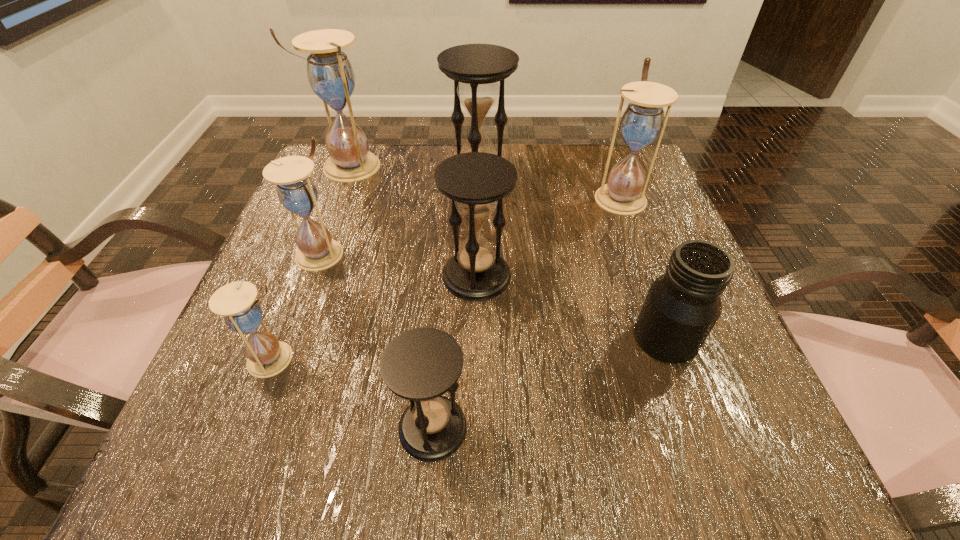
Identify the location of object present at the near edge. (421, 364).

The image size is (960, 540). What are the coordinates of `hourglass that is at the right edge` in the screenshot? It's located at click(643, 120).

The width and height of the screenshot is (960, 540). I want to click on jar that is positioned at the right edge, so 682,306.

At what (x,y) coordinates should I click in order to perform the action: click on object at the far left corner. Please return your answer as a coordinate pair (x, y). This screenshot has width=960, height=540. Looking at the image, I should click on (330, 74).

This screenshot has height=540, width=960. Find the location of `object present at the far right corner`. object present at the far right corner is located at coordinates (643, 120).

Where is `free space at the far edge`? This screenshot has height=540, width=960. free space at the far edge is located at coordinates (444, 160).

Locate an element on the screen. The width and height of the screenshot is (960, 540). free space at the near edge of the desktop is located at coordinates (410, 472).

The image size is (960, 540). I want to click on free space at the left edge of the desktop, so click(x=205, y=413).

The height and width of the screenshot is (540, 960). In the image, there is a desktop. Identify the location of vacant space at the right edge. (642, 367).

This screenshot has height=540, width=960. I want to click on vacant position at the far right corner of the desktop, so (x=606, y=152).